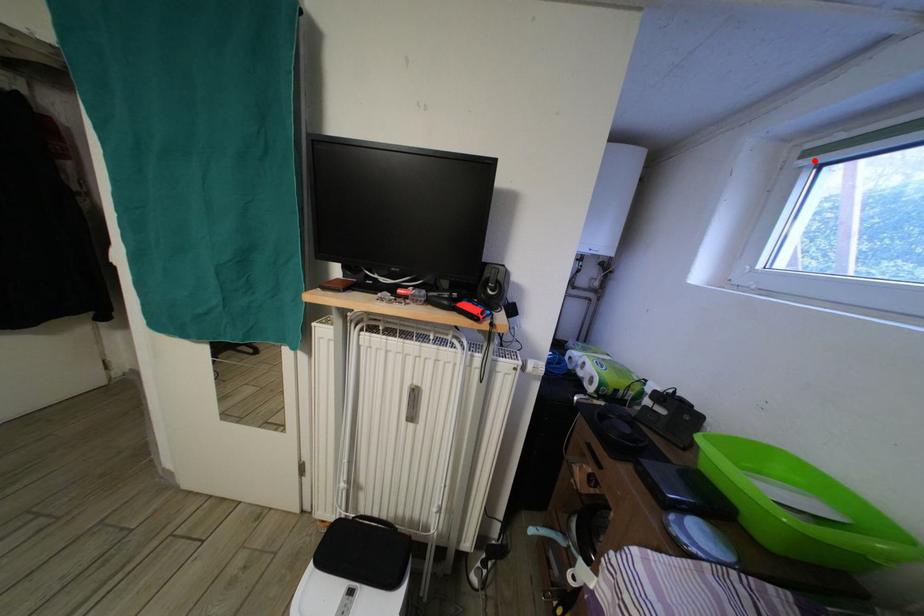
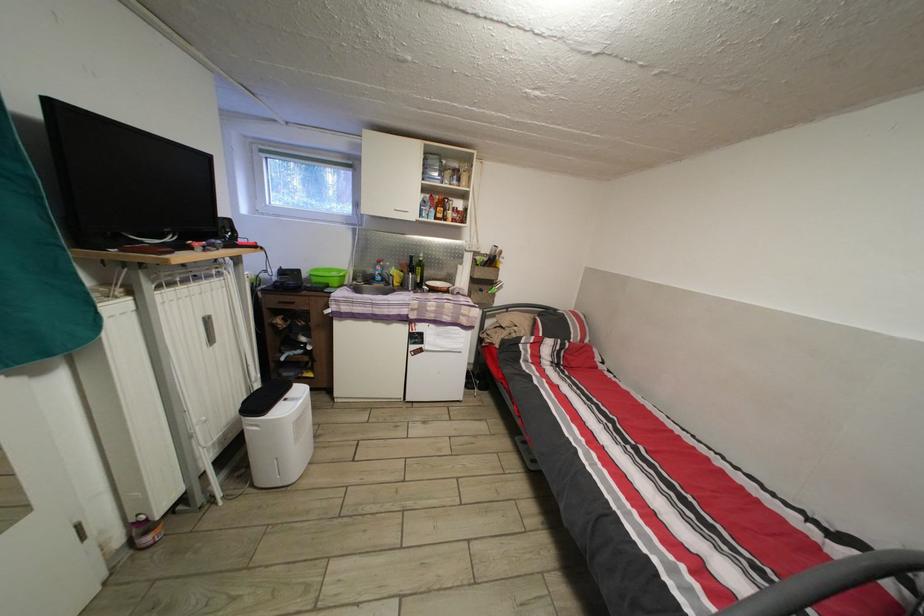
Locate, in the second image, the point that corresponds to the highlighted location in the first image.

(269, 156)